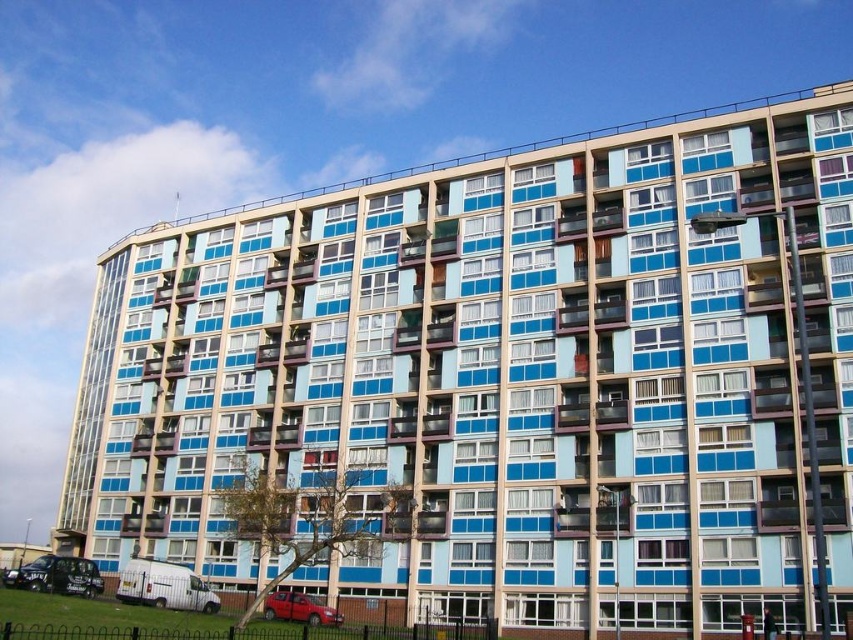
You are a pedestrian standing on the sidewalk in front of the building. You see the black matte taxi at lower left and the metallic red car at lower center. Which car is closer to you?

The black matte taxi at lower left is closer to you because the metallic red car at lower center is behind it.

You are standing at the entrance of the building and want to hail a ride. The black matte taxi at lower left and the metallic red car at lower center are both available. Which vehicle is closer to you?

The black matte taxi at lower left is 13.58 meters away from the metallic red car at lower center. Since you are at the entrance, the distance between the two vehicles indicates that the metallic red car at lower center is closer to you than the black matte taxi at lower left.

You are standing in front of the residential building and notice two points marked on the facade. The first point is located at coordinates point (33, 566) and the second at point (308, 605). Which of these two points is closer to your current position?

Point (33, 566) is closer to your current position because it is further to the viewer than point (308, 605).